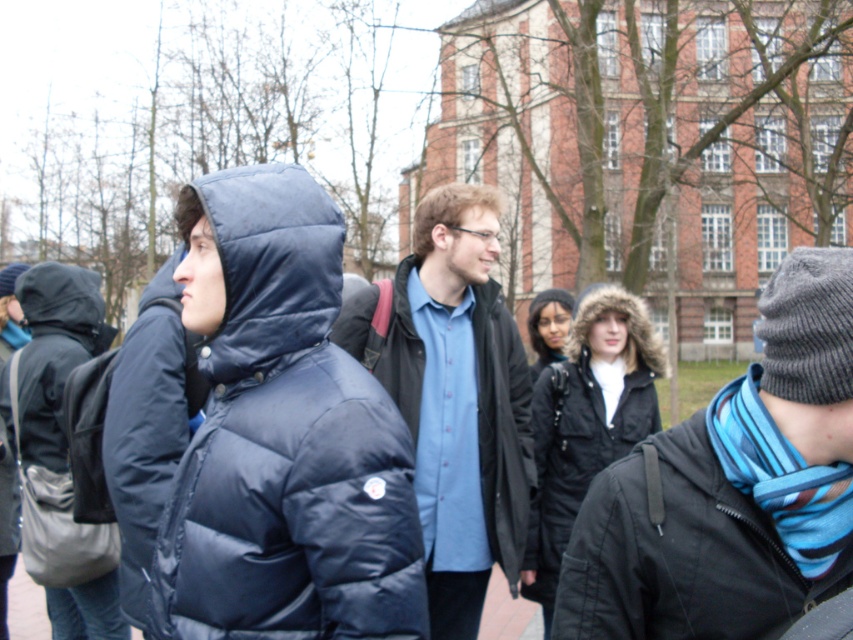
Question: Which is nearer to the matte blue puffer jacket at left?

Choices:
 (A) matte black coat at left
 (B) matte black backpack at left
 (C) matte blue shirt at center
 (D) black matte jacket at lower right

Answer: (D)

Question: Which object is positioned farthest from the matte blue puffer jacket at left?

Choices:
 (A) matte black backpack at left
 (B) matte black coat at left
 (C) matte black jacket at left

Answer: (C)

Question: Is black matte jacket at lower right wider than matte black jacket at left?

Choices:
 (A) yes
 (B) no

Answer: (A)

Question: Which point is farther from the camera taking this photo?

Choices:
 (A) (637, 314)
 (B) (7, 440)
 (C) (572, 579)

Answer: (B)

Question: Can you confirm if matte black backpack at left is positioned below black fur-lined coat at center?

Choices:
 (A) yes
 (B) no

Answer: (A)

Question: Is matte blue puffer jacket at left wider than matte black coat at left?

Choices:
 (A) no
 (B) yes

Answer: (B)